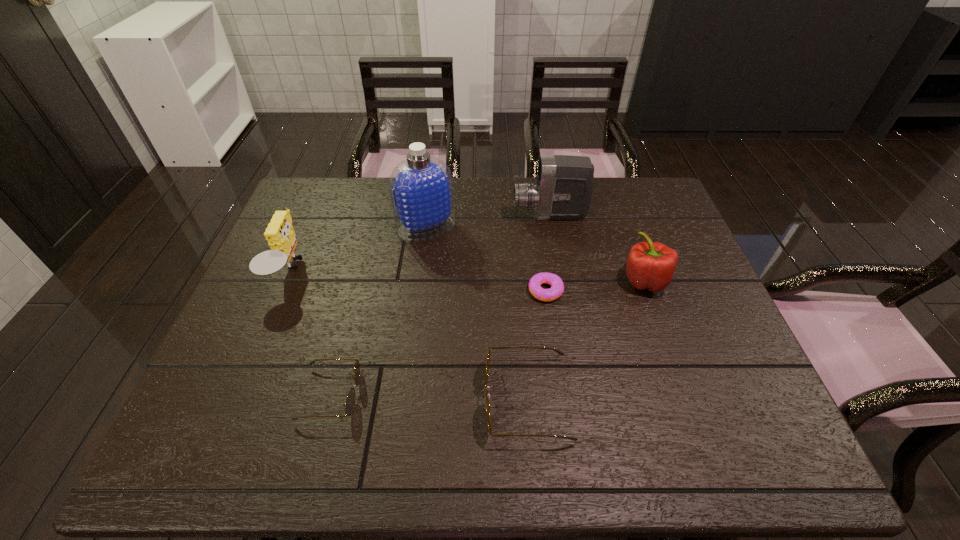
You are a GUI agent. You are given a task and a screenshot of the screen. Output one action in this format:
    pyautogui.click(x=<x>, y=<y>)
    Task: Click on the object that is the sixth closest one to the sixth shortest object
    Image resolution: width=960 pixels, height=540 pixels.
    Given the screenshot: What is the action you would take?
    pyautogui.click(x=350, y=400)

The width and height of the screenshot is (960, 540). I want to click on the second closest object to the sponge, so click(x=421, y=187).

I want to click on blank space that satisfies the following two spatial constraints: 1. at the front of the sixth shortest object, highlighting the lens; 2. on the front side of the shortest object, so click(563, 291).

In order to click on vacant space that satisfies the following two spatial constraints: 1. on the back side of the shortest object; 2. on the front-facing side of the sponge in this screenshot , I will do `click(542, 271)`.

Where is `free location that satisfies the following two spatial constraints: 1. on the front side of the fifth object from right to left; 2. on the front-facing side of the leftmost object`? The width and height of the screenshot is (960, 540). free location that satisfies the following two spatial constraints: 1. on the front side of the fifth object from right to left; 2. on the front-facing side of the leftmost object is located at coordinates (420, 271).